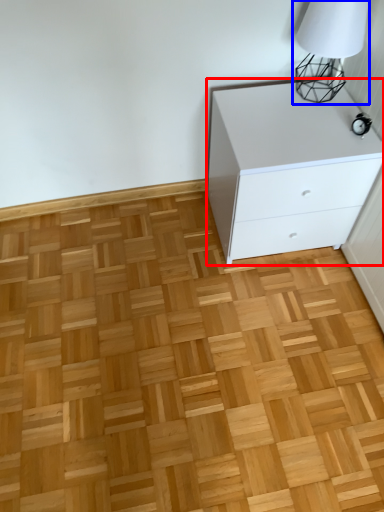
Question: Among these objects, which one is farthest to the camera, chest of drawers (highlighted by a red box) or table lamp (highlighted by a blue box)?

Choices:
 (A) chest of drawers
 (B) table lamp

Answer: (A)